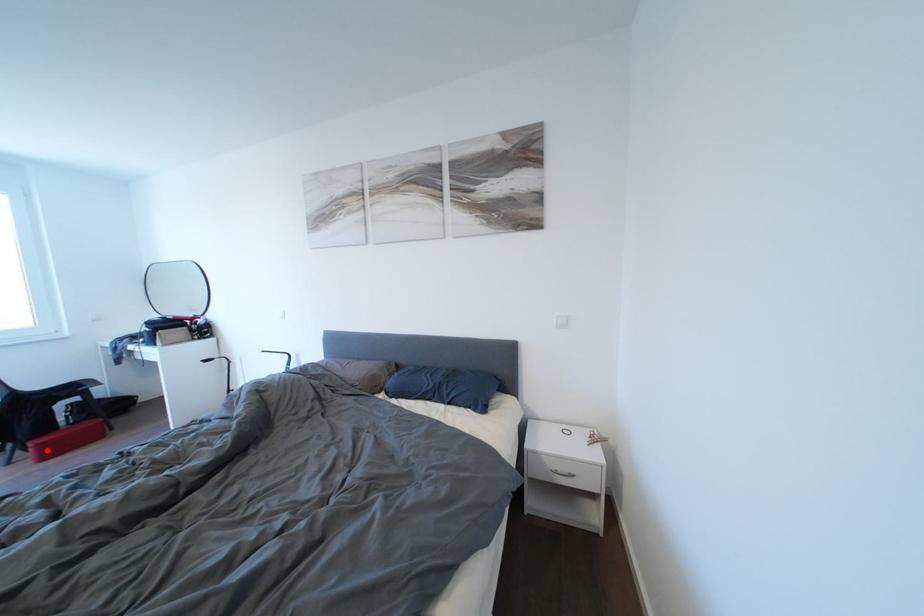
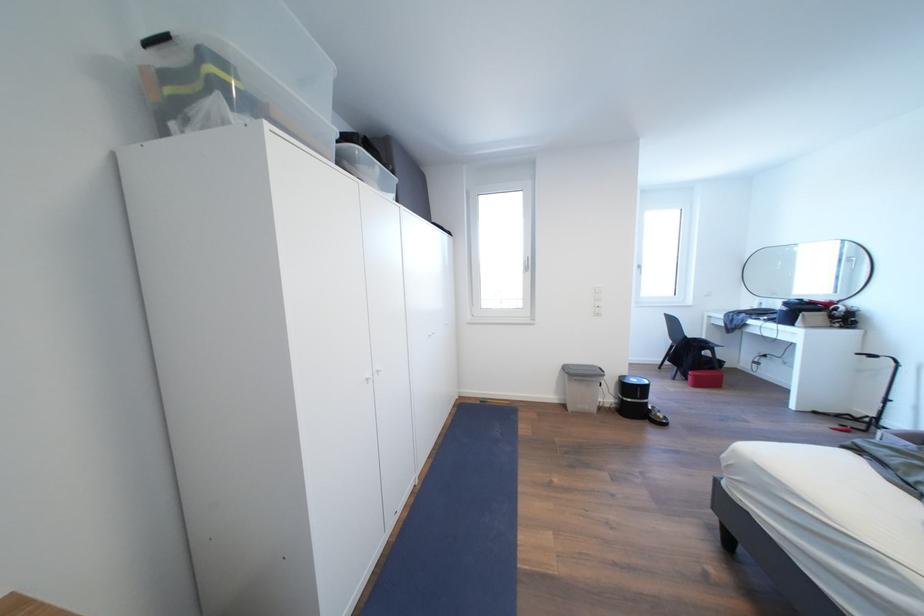
Question: A red point is marked in image1. In image2, is the corresponding 3D point closer to the camera or farther? Reply with the corresponding letter.

Choices:
 (A) The corresponding 3D point is closer.
 (B) The corresponding 3D point is farther.

Answer: (B)